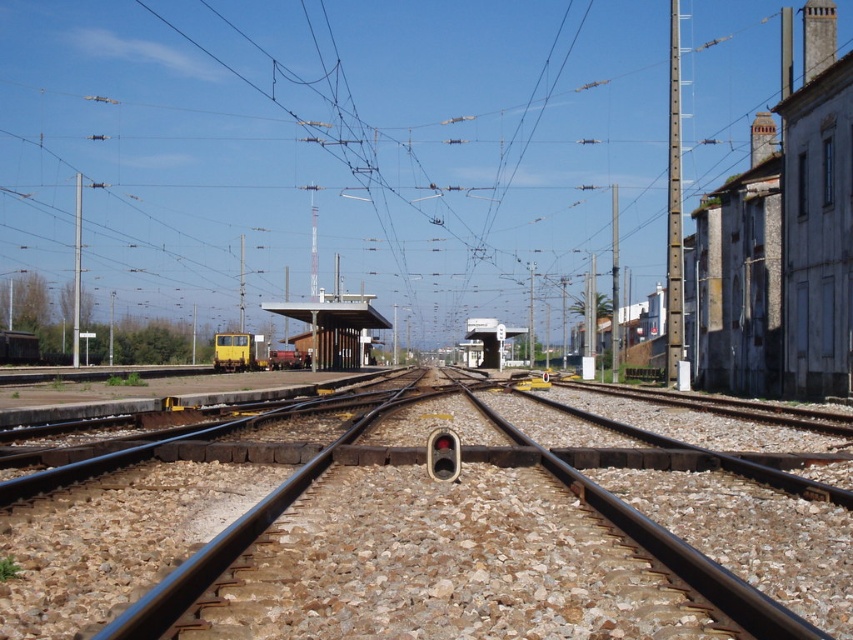
You are standing at the signal box in the railway scene. You want to walk to the white concrete platform at center. Which direction should you go?

The white concrete platform at center is located at point (334, 326) in the image, so you should walk towards the center of the image to reach it.